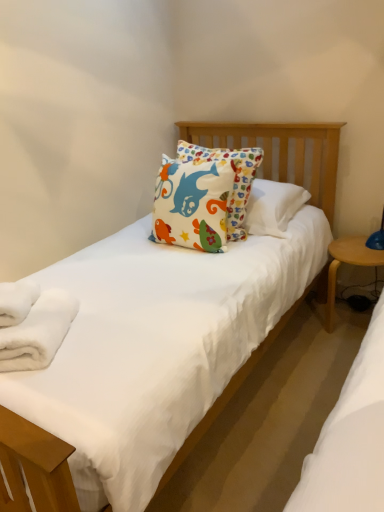
Question: Is point (13, 305) closer or farther from the camera than point (21, 310)?

Choices:
 (A) closer
 (B) farther

Answer: (B)

Question: Is white fluffy bath towel at lower left, which is counted as the 1th bath towel, starting from the bottom, inside the boundaries of white soft towel at lower left, positioned as the 1th bath towel in top-to-bottom order, or outside?

Choices:
 (A) outside
 (B) inside

Answer: (A)

Question: Which of these objects is positioned farthest from the light wood/wooden table at right?

Choices:
 (A) white soft towel at lower left, the 2th bath towel when ordered from bottom to top
 (B) white fluffy bath towel at lower left, which is counted as the 1th bath towel, starting from the bottom

Answer: (A)

Question: Which object is positioned closest to the white fluffy bath towel at lower left, placed as the second bath towel when sorted from top to bottom?

Choices:
 (A) light wood/wooden table at right
 (B) white soft towel at lower left, the 2th bath towel when ordered from bottom to top

Answer: (B)